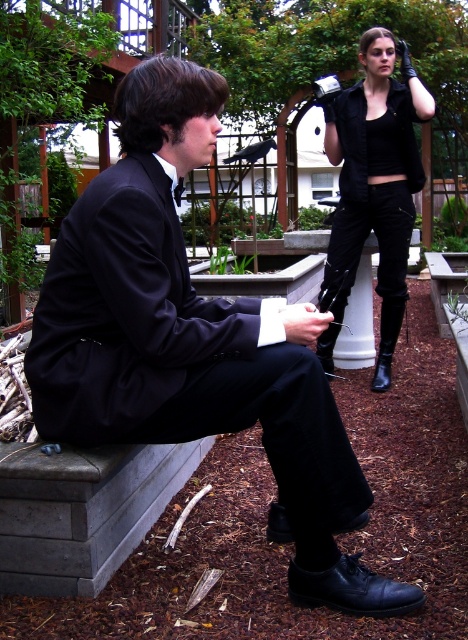
Is matte black vest at upper right to the left of black leather boot at lower center from the viewer's perspective?

No, matte black vest at upper right is not to the left of black leather boot at lower center.

Is point (385, 353) farther from camera compared to point (336, 332)?

No.

Which is behind, point (380, 192) or point (321, 355)?

Point (321, 355)

Find the location of `matte black vest at upper right`. matte black vest at upper right is located at coordinates (374, 180).

Between point (378, 371) and point (327, 353), which one is positioned behind?

The point (327, 353) is more distant.

This screenshot has width=468, height=640. What do you see at coordinates (387, 340) in the screenshot?
I see `black leather boot at lower right` at bounding box center [387, 340].

The image size is (468, 640). I want to click on black leather boot at lower right, so pos(387,340).

At what (x,y) coordinates should I click in order to perform the action: click on black leather boot at lower right. Please return your answer as a coordinate pair (x, y). Looking at the image, I should click on (387, 340).

In the scene shown: Can you confirm if matte black vest at upper right is positioned below black leather boot at lower right?

No, matte black vest at upper right is not below black leather boot at lower right.

Where is `matte black vest at upper right`? The height and width of the screenshot is (640, 468). matte black vest at upper right is located at coordinates (374, 180).